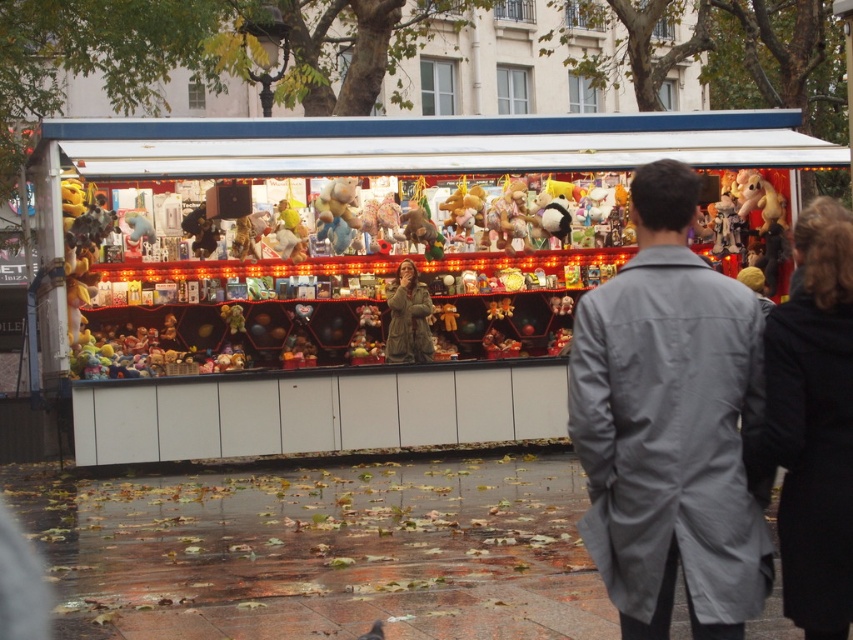
You are standing at the origin point of the coordinate system where the stall is located. The stall has a coordinate system where the bottom left corner is at point 0,0 and the top right corner is at point 1,1. You want to place a new display stand exactly at the center of the stall. Is the matte plastic toy stand at center already positioned at the center of the stall?

The matte plastic toy stand at center is positioned at point (363,273), which is close to but not exactly at the center of the stall. The true center would be at point (426,320). Therefore, the stand is slightly to the left and down from the center.

You are a customer at the vendor stall and want to place a large gift box on the matte plastic toy stand at center. The gift box is as wide as the gray fabric coat at center. Will the gift box fit on the stand?

The matte plastic toy stand at center is narrower than the gray fabric coat at center, so the gift box, which is as wide as the coat, will not fit on the stand.

You are a customer standing in front of the vendor stall. You notice the matte plastic toy stand at center and the gray fabric coat at center. Which object is taller?

The gray fabric coat at center is taller than the matte plastic toy stand at center.